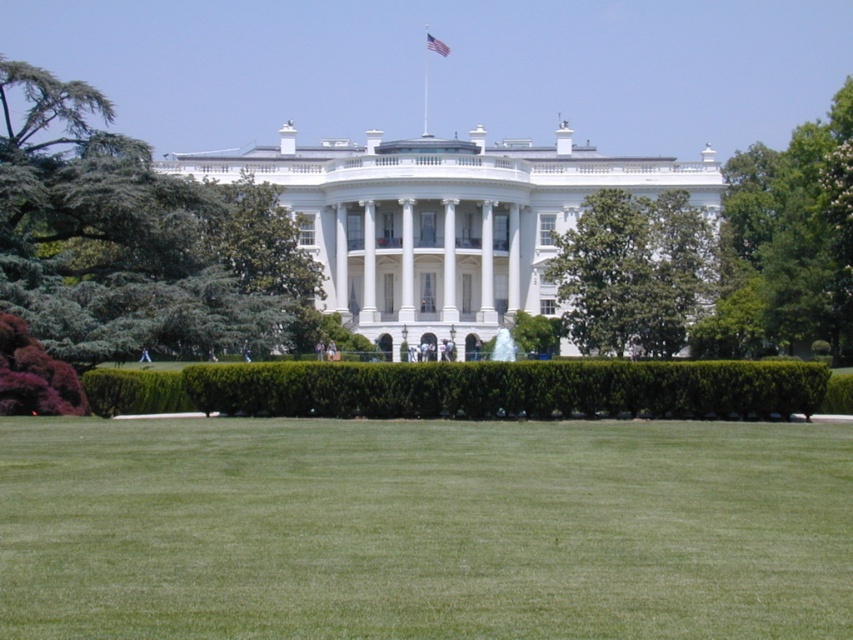
Can you confirm if green leafy hedge at center is shorter than green leafy tree at center?

Indeed, green leafy hedge at center has a lesser height compared to green leafy tree at center.

Does green leafy hedge at center have a smaller size compared to green leafy tree at center?

Indeed, green leafy hedge at center has a smaller size compared to green leafy tree at center.

Which is in front, point (149, 392) or point (547, 268)?

Point (149, 392) is in front.

Locate an element on the screen. Image resolution: width=853 pixels, height=640 pixels. green leafy hedge at center is located at coordinates (468, 388).

Which is in front, point (201, 342) or point (426, 109)?

Point (201, 342) is in front.

Does point (68, 202) come behind point (422, 99)?

No, (68, 202) is closer to viewer.

What do you see at coordinates (131, 236) in the screenshot? I see `green leafy tree at left` at bounding box center [131, 236].

Find the location of `green leafy tree at left`. green leafy tree at left is located at coordinates (131, 236).

The image size is (853, 640). Describe the element at coordinates (422, 529) in the screenshot. I see `green smooth grass at lower center` at that location.

Can you confirm if green smooth grass at lower center is wider than green leafy tree at center?

Yes.

Is point (90, 518) positioned in front of point (561, 321)?

Yes.

Locate an element on the screen. green smooth grass at lower center is located at coordinates (422, 529).